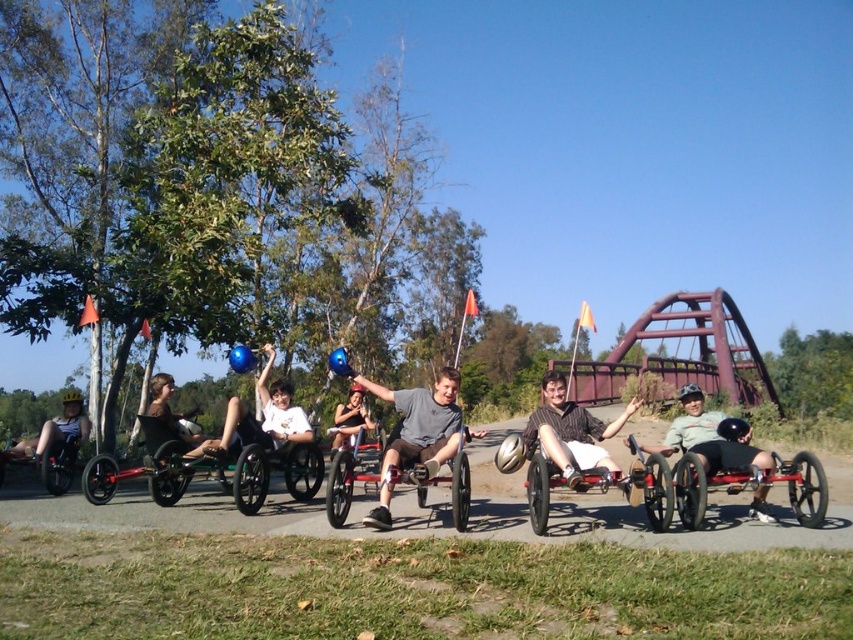
Question: Does striped shirt at center appear on the left side of matte black tricycle at center?

Choices:
 (A) no
 (B) yes

Answer: (A)

Question: Is white matte balloon at center closer to camera compared to white cotton shirt at center?

Choices:
 (A) yes
 (B) no

Answer: (A)

Question: Does white matte balloon at center appear on the right side of matte black wheelchair at center?

Choices:
 (A) no
 (B) yes

Answer: (A)

Question: Estimate the real-world distances between objects in this image. Which object is farther from the metallic silver wheelchair at center?

Choices:
 (A) white matte balloon at center
 (B) matte black helmet at center
 (C) matte black wheelchair at center
 (D) matte black wheelchair at left

Answer: (C)

Question: Which of these objects is positioned closest to the white matte balloon at center?

Choices:
 (A) matte black tricycle at center
 (B) metallic silver wheelchair at center
 (C) matte black wheelchair at left
 (D) matte black wheelchair at center

Answer: (B)

Question: Which object is positioned closest to the metallic red tricycle at center?

Choices:
 (A) matte black tricycle at center
 (B) metallic red wheelchair at center

Answer: (A)